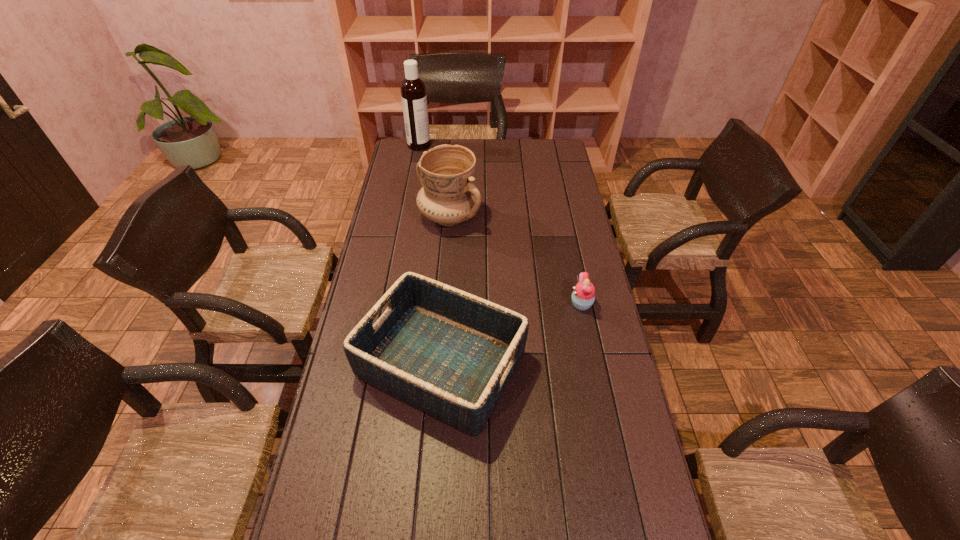
Identify the location of the tallest object. This screenshot has height=540, width=960. (413, 90).

The image size is (960, 540). Find the location of `dishwasher detergent`. dishwasher detergent is located at coordinates (413, 90).

Find the location of a particular element. This screenshot has height=540, width=960. pottery is located at coordinates (449, 197).

Where is `the third shortest object`? The width and height of the screenshot is (960, 540). the third shortest object is located at coordinates (449, 197).

You are a GUI agent. You are given a task and a screenshot of the screen. Output one action in this format:
    pyautogui.click(x=<x>, y=<y>)
    Task: Click on the third tallest object
    The height and width of the screenshot is (540, 960).
    Given the screenshot: What is the action you would take?
    pyautogui.click(x=451, y=354)

You are a GUI agent. You are given a task and a screenshot of the screen. Output one action in this format:
    pyautogui.click(x=<x>, y=<y>)
    Task: Click on the cupcake
    The width and height of the screenshot is (960, 540).
    Given the screenshot: What is the action you would take?
    pyautogui.click(x=583, y=296)

Find the location of `the shortest object`. the shortest object is located at coordinates (583, 296).

The image size is (960, 540). I want to click on free space located on the label side of the farthest object, so click(444, 145).

Locate an element on the screen. free spot located on the front of the third nearest object is located at coordinates (443, 315).

You are a GUI agent. You are given a task and a screenshot of the screen. Output one action in this format:
    pyautogui.click(x=<x>, y=<y>)
    Task: Click on the vacant position located 0.090m on the back of the basket
    This screenshot has height=540, width=960.
    Given the screenshot: What is the action you would take?
    pyautogui.click(x=447, y=284)